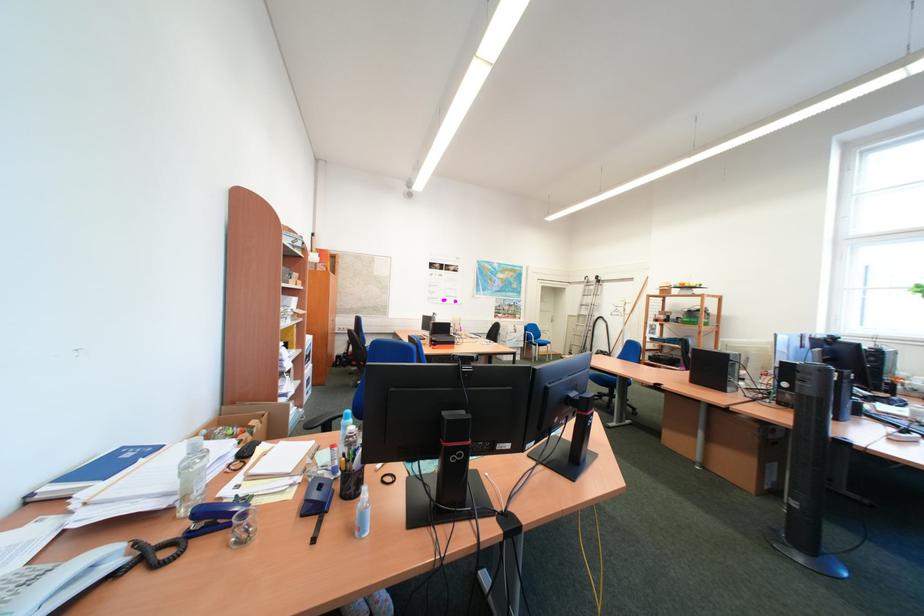
Where is `black tape dispenser`? Image resolution: width=924 pixels, height=616 pixels. black tape dispenser is located at coordinates (453, 461).